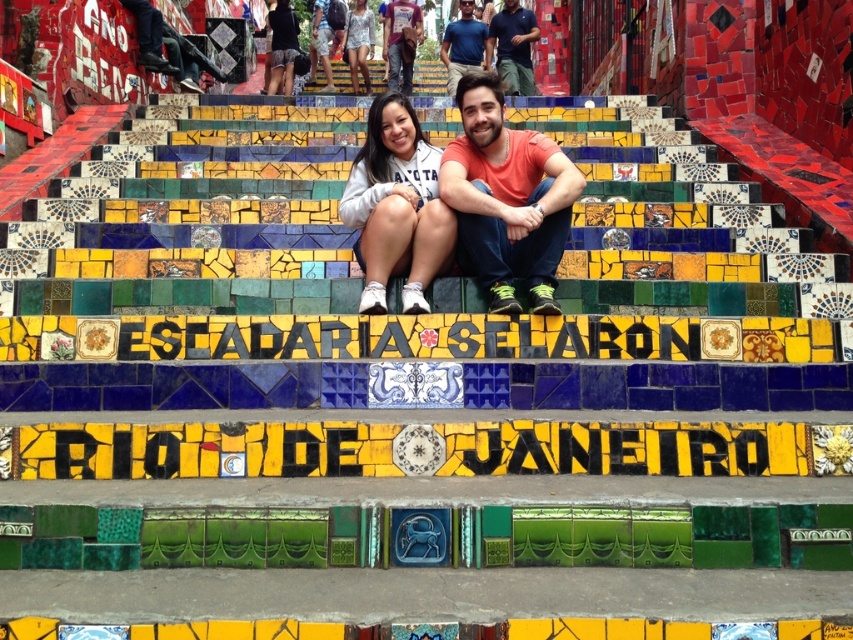
Can you confirm if white matte sweatshirt at center is bigger than matte orange shirt at center?

Incorrect, white matte sweatshirt at center is not larger than matte orange shirt at center.

Between white matte sweatshirt at center and matte orange shirt at center, which one is positioned lower?

white matte sweatshirt at center is lower down.

Is point (366, 284) positioned behind point (395, 3)?

No, it is not.

Where is `white matte sweatshirt at center`? white matte sweatshirt at center is located at coordinates (396, 205).

Who is lower down, orange cotton shirt at center or blue cotton shirt at upper center?

orange cotton shirt at center is below.

Is point (538, 144) positioned behind point (451, 76)?

No.

Which is behind, point (518, 269) or point (483, 28)?

Point (483, 28)

At what (x,y) coordinates should I click in order to perform the action: click on orange cotton shirt at center. Please return your answer as a coordinate pair (x, y). The width and height of the screenshot is (853, 640). Looking at the image, I should click on (506, 198).

Between matte orange shirt at center and matte black dress at center, which one has less height?

matte black dress at center is shorter.

Can you confirm if matte orange shirt at center is positioned to the left of matte black dress at center?

Incorrect, matte orange shirt at center is not on the left side of matte black dress at center.

Who is more forward, (396, 88) or (279, 35)?

Point (279, 35) is more forward.

I want to click on matte orange shirt at center, so click(401, 42).